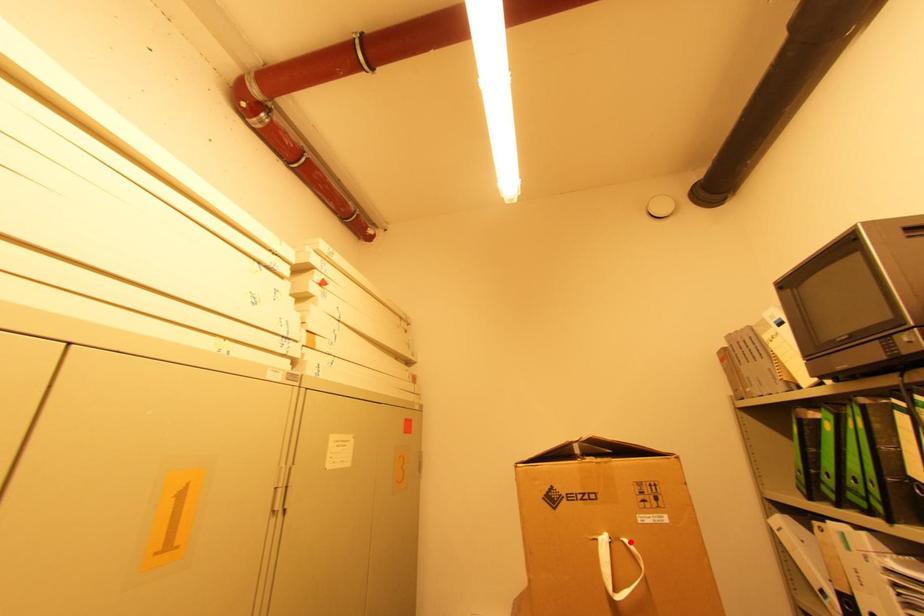
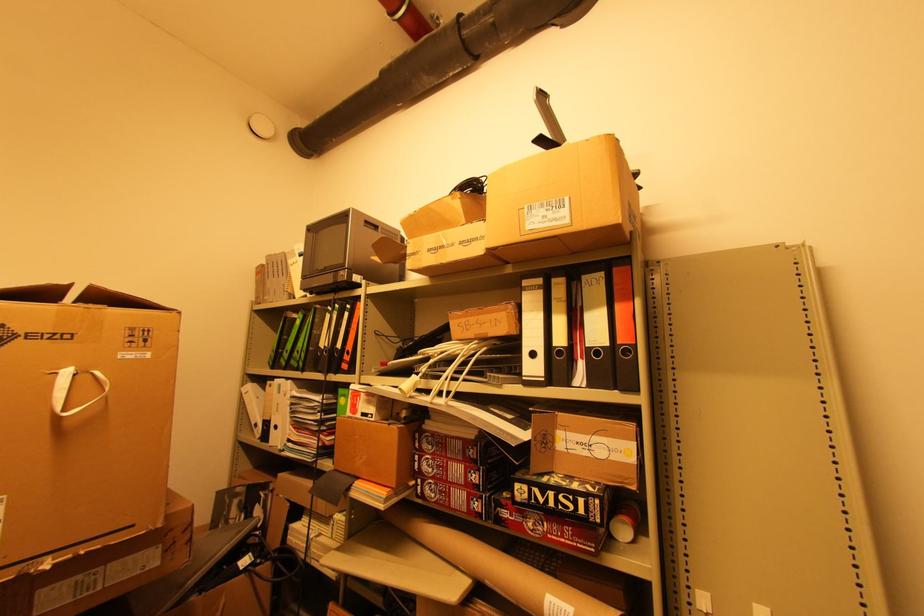
Locate, in the second image, the point that corresponds to the highlighted location in the first image.

(101, 373)